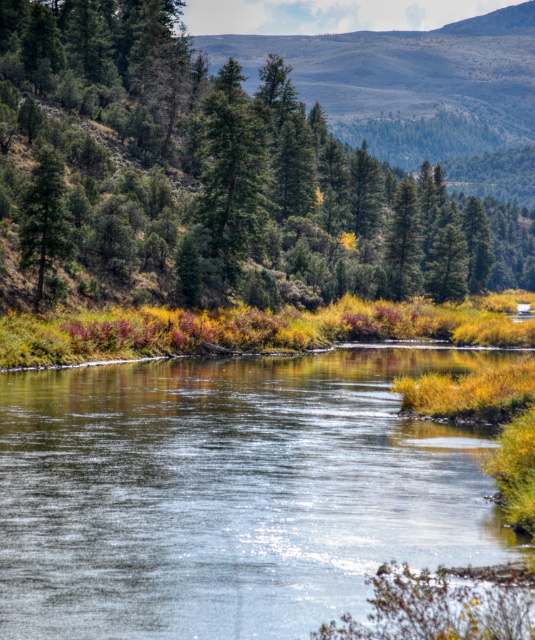
You are a hiker standing at the edge of the steep forested hillside on the left. You want to cross the river to the opposite bank. The clear water at center is flowing gently. Can you safely cross the river at this point?

The clear water at center is 16.54 meters away from the steep forested hillside on the left. Since the river is flowing gently and the water appears shallow with visible grass patches, it might be possible to cross safely. However, the distance and the steep terrain of the hillside may pose challenges. It is recommended to assess the riverbed stability and ensure secure footing before attempting the crossing.

From the picture: Based on the scene description, where is the clear water at center located in terms of coordinates?

The clear water at center is located at point coordinates of (231, 492).

You are a hiker standing at the base of the green matte tree at upper center. You want to cross the river to reach the other side. The clear water at center is flowing towards the opposite bank. Can you safely cross the river at this point?

The green matte tree at upper center is 339.67 feet away from the clear water at center. Since the distance is quite large, it might be challenging to cross the river safely at this point without proper equipment or a bridge.